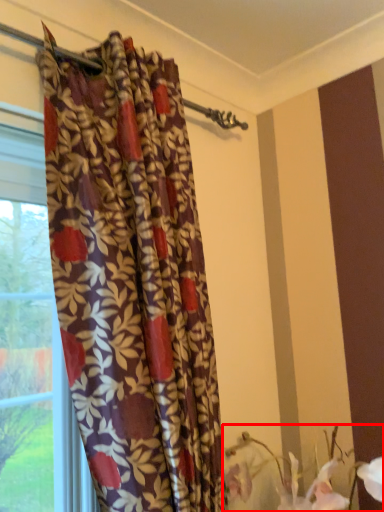
Question: Observing the image, what is the correct spatial positioning of floral arrangement (annotated by the red box) in reference to curtain?

Choices:
 (A) right
 (B) left

Answer: (A)